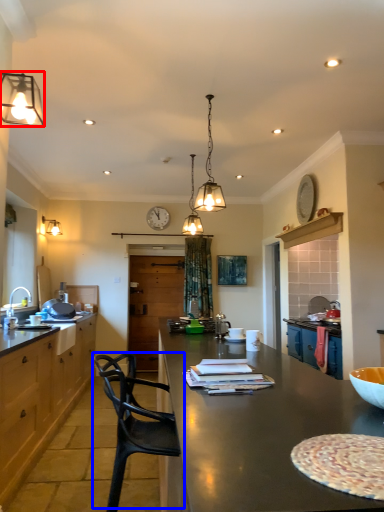
Question: Among these objects, which one is nearest to the camera, lamp (highlighted by a red box) or chair (highlighted by a blue box)?

Choices:
 (A) lamp
 (B) chair

Answer: (B)